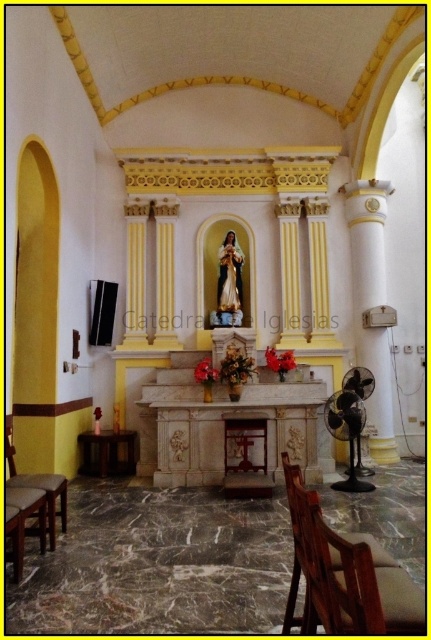
Question: Can you confirm if wooden chair at lower right is positioned to the right of brown leather chair at lower left?

Choices:
 (A) yes
 (B) no

Answer: (A)

Question: Which of the following is the farthest from the observer?

Choices:
 (A) (62, 528)
 (B) (293, 492)

Answer: (A)

Question: Observing the image, what is the correct spatial positioning of wooden chair at lower right in reference to brown leather chair at lower left?

Choices:
 (A) right
 (B) left

Answer: (A)

Question: Which point appears closest to the camera in this image?

Choices:
 (A) (50, 515)
 (B) (318, 554)

Answer: (B)

Question: From the image, what is the correct spatial relationship of black plastic fan at lower right in relation to brown leather chair at lower left?

Choices:
 (A) right
 (B) left

Answer: (A)

Question: Estimate the real-world distances between objects in this image. Which object is closer to the wooden chair at lower right?

Choices:
 (A) brown leather chair at lower left
 (B) black plastic fan at lower right

Answer: (A)